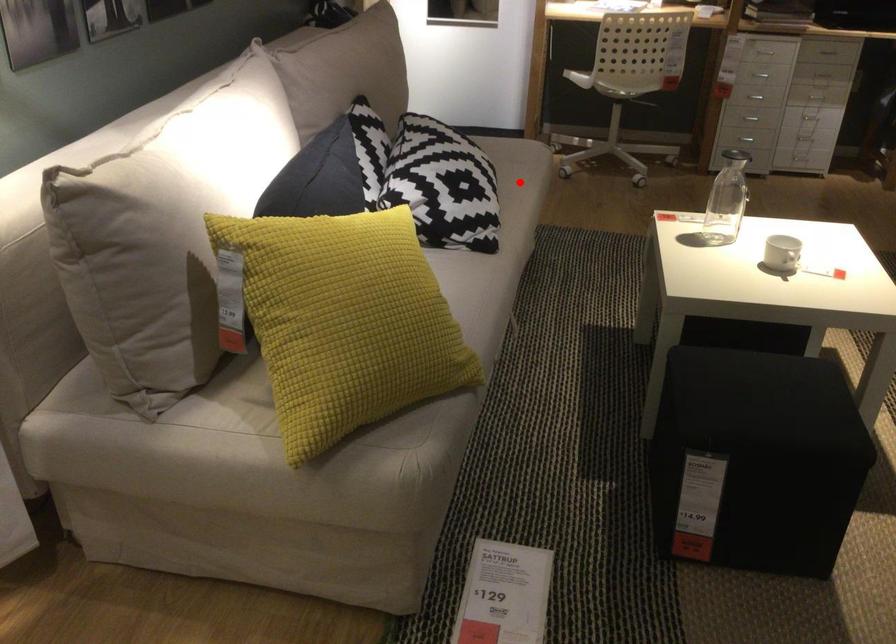
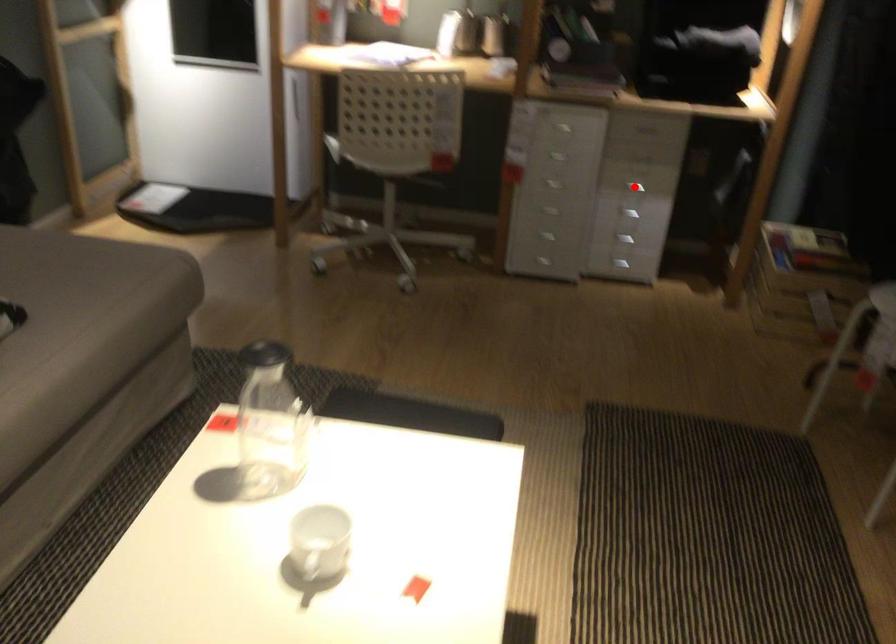
I am providing you with two images of the same scene from different viewpoints. A red point is marked on the first image and another point is marked on the second image. Do the highlighted points in image1 and image2 indicate the same real-world spot?

No